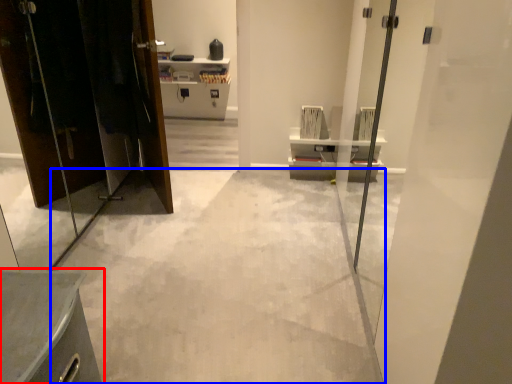
Question: Which point is further to the camera, furniture (highlighted by a red box) or concrete (highlighted by a blue box)?

Choices:
 (A) furniture
 (B) concrete

Answer: (B)